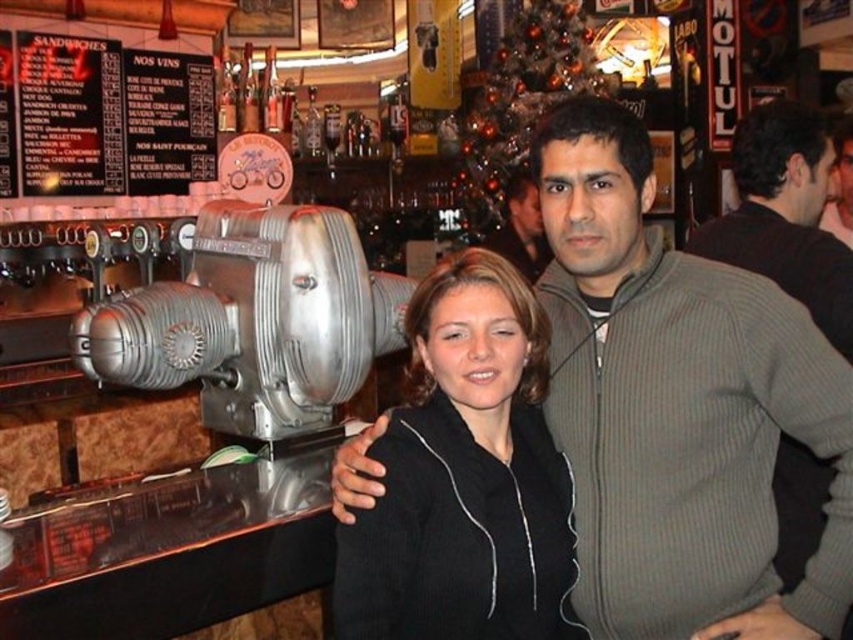
Who is higher up, black zip-up jacket at center or gray zip-up sweater at center?

Positioned higher is gray zip-up sweater at center.

Does black zip-up jacket at center have a greater height compared to gray zip-up sweater at center?

Yes, black zip-up jacket at center is taller than gray zip-up sweater at center.

Between point (614, 131) and point (529, 193), which one is positioned behind?

Positioned behind is point (529, 193).

Image resolution: width=853 pixels, height=640 pixels. Identify the location of black zip-up jacket at center. (679, 406).

Between black matte jacket at center and dark gray sweater at right, which one is positioned higher?

dark gray sweater at right is higher up.

Is black matte jacket at center to the right of dark gray sweater at right from the viewer's perspective?

No, black matte jacket at center is not to the right of dark gray sweater at right.

This screenshot has height=640, width=853. What do you see at coordinates (466, 477) in the screenshot?
I see `black matte jacket at center` at bounding box center [466, 477].

This screenshot has width=853, height=640. In order to click on black matte jacket at center in this screenshot , I will do [466, 477].

From the picture: Which is above, black zip-up jacket at center or black matte jacket at center?

black zip-up jacket at center

Can you confirm if black zip-up jacket at center is smaller than black matte jacket at center?

Actually, black zip-up jacket at center might be larger than black matte jacket at center.

Which is behind, point (601, 612) or point (442, 445)?

The point (601, 612) is behind.

Locate an element on the screen. This screenshot has height=640, width=853. black zip-up jacket at center is located at coordinates (679, 406).